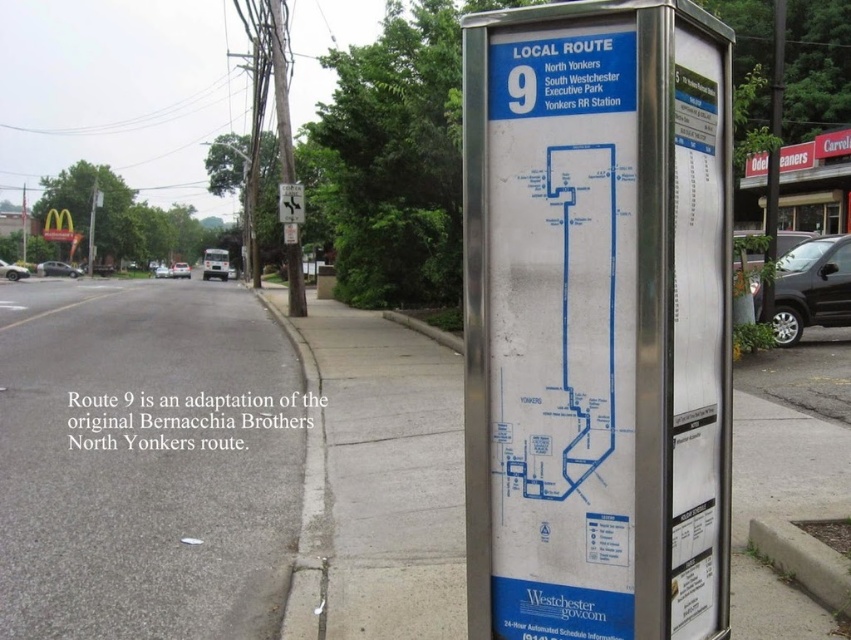
You are a delivery driver who needs to park your 2.5 meter wide truck on the street. The truck requires a space at least as wide as the silver metallic pavement at center. Can you park your truck there without overlapping the metallic silver street sign at upper center?

The silver metallic pavement at center is wider than the metallic silver street sign at upper center. Since the truck requires a space at least as wide as the pavement, it can be parked there without overlapping the sign.

You are a delivery driver approaching the intersection ahead. You see the gray asphalt road at lower left and the silver metallic pavement at center. Which one is higher in elevation?

The gray asphalt road at lower left is taller than the silver metallic pavement at center, so the gray asphalt road at lower left has a higher elevation.